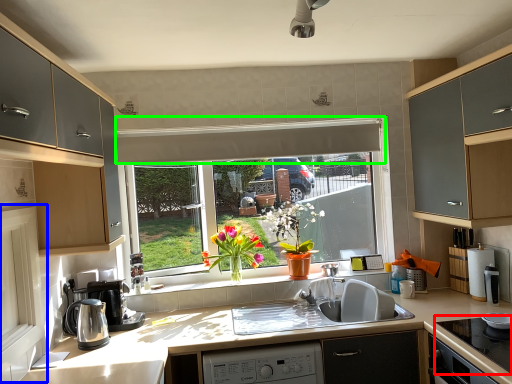
Question: Based on their relative distances, which object is nearer to gas stove (highlighted by a red box)? Choose from screen door (highlighted by a blue box) and exhaust hood (highlighted by a green box).

Choices:
 (A) screen door
 (B) exhaust hood

Answer: (B)